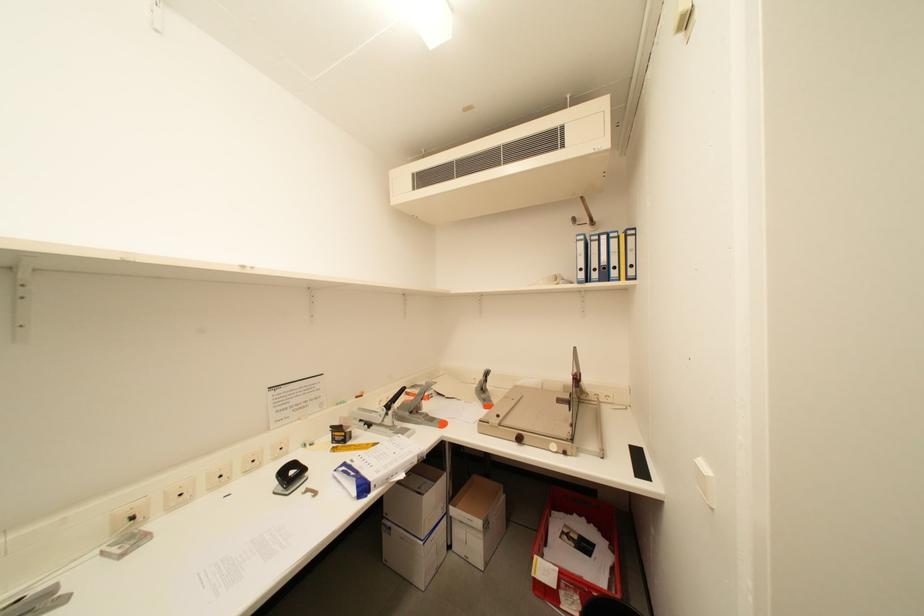
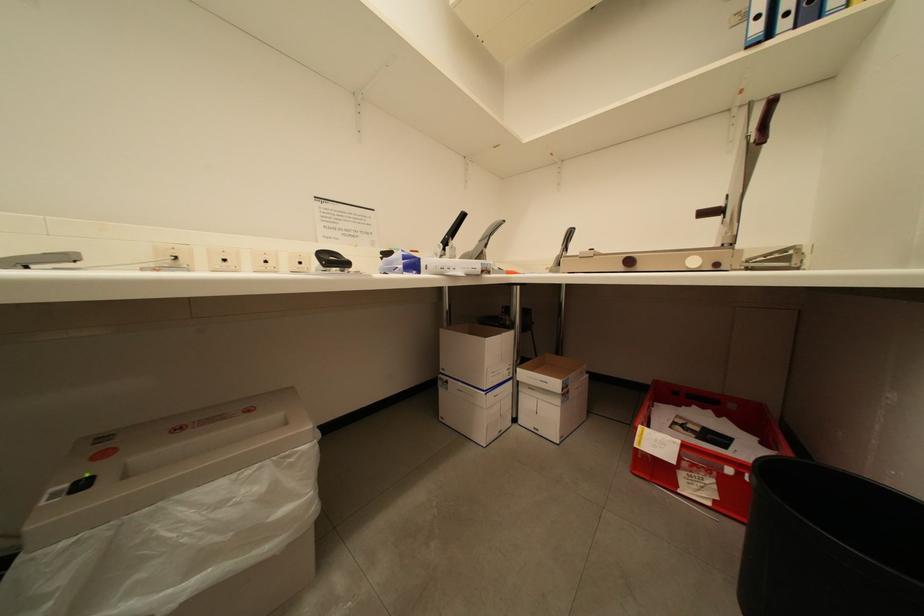
Question: Based on the continuous images, in which direction is the camera rotating? Reply with the corresponding letter.

Choices:
 (A) Left
 (B) Right
 (C) Up
 (D) Down

Answer: (A)